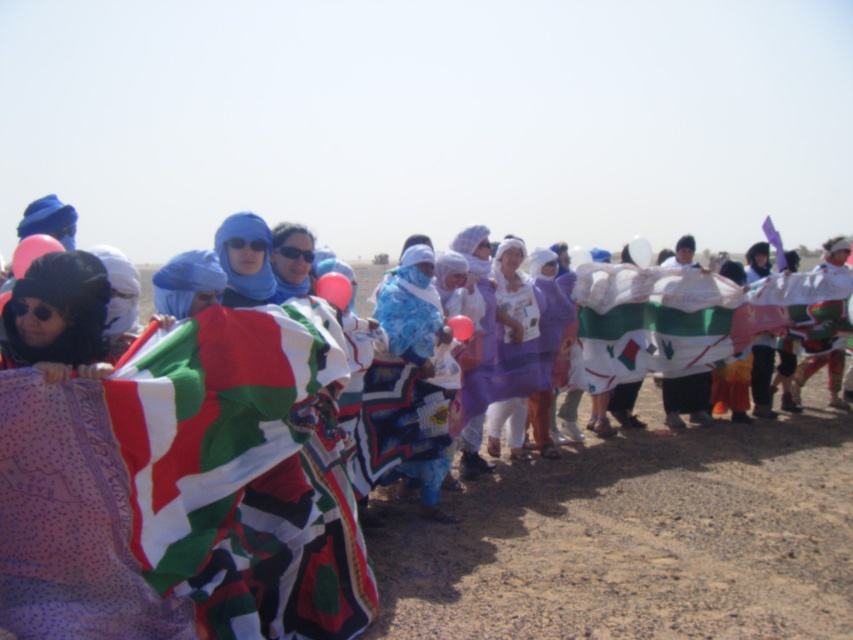
Question: Does printed fabric scarf at center have a larger size compared to purple fabric at center?

Choices:
 (A) yes
 (B) no

Answer: (B)

Question: Is printed fabric scarf at center bigger than purple fabric at center?

Choices:
 (A) no
 (B) yes

Answer: (A)

Question: In this image, where is printed fabric scarf at center located relative to purple fabric at center?

Choices:
 (A) left
 (B) right

Answer: (B)

Question: Which point is farther to the camera?

Choices:
 (A) printed fabric scarf at center
 (B) purple fabric at center

Answer: (A)

Question: Among these points, which one is nearest to the camera?

Choices:
 (A) [x=535, y=356]
 (B) [x=723, y=435]

Answer: (A)